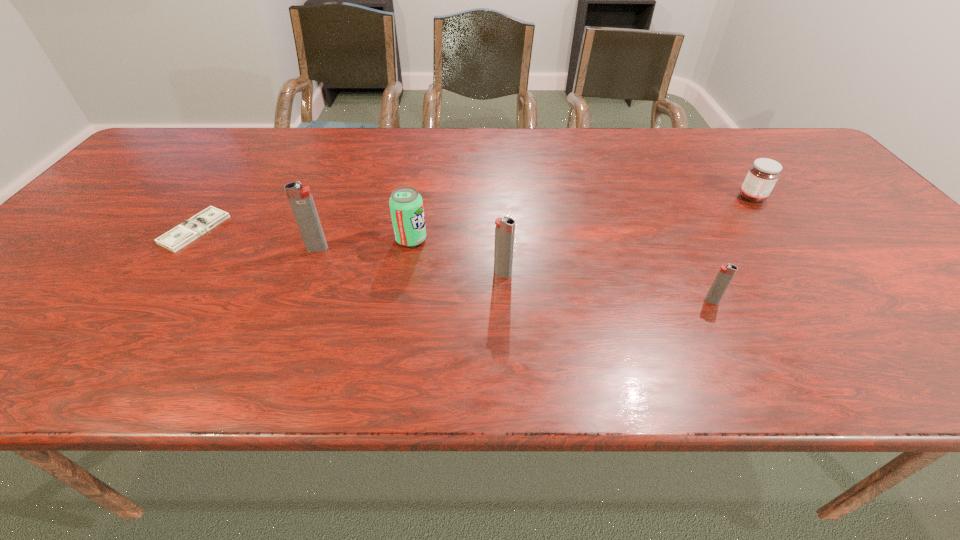
Locate an element on the screen. This screenshot has width=960, height=540. vacant space at the near edge of the desktop is located at coordinates (726, 317).

Find the location of a particular element. free space at the left edge of the desktop is located at coordinates (108, 217).

The height and width of the screenshot is (540, 960). In the image, there is a desktop. In order to click on vacant space at the right edge in this screenshot , I will do `click(811, 167)`.

What are the coordinates of `vacant area at the far left corner of the desktop` in the screenshot? It's located at (194, 159).

The image size is (960, 540). Find the location of `free space at the far right corner of the desktop`. free space at the far right corner of the desktop is located at coordinates (792, 136).

At what (x,y) coordinates should I click in order to perform the action: click on free space that is in between the nearest igniter and the shortest object. Please return your answer as a coordinate pair (x, y). This screenshot has width=960, height=540. Looking at the image, I should click on (453, 265).

At what (x,y) coordinates should I click in order to perform the action: click on vacant space that is in between the farthest object and the shortest object. Please return your answer as a coordinate pair (x, y). This screenshot has height=540, width=960. Looking at the image, I should click on (473, 213).

This screenshot has width=960, height=540. What are the coordinates of `vacant space that is in between the jam and the third tallest object` in the screenshot? It's located at (582, 218).

This screenshot has width=960, height=540. What are the coordinates of `vacant space in between the second tallest igniter and the rightmost igniter` in the screenshot? It's located at (607, 287).

At what (x,y) coordinates should I click in order to perform the action: click on free space between the farthest object and the third tallest object. Please return your answer as a coordinate pair (x, y). The image size is (960, 540). Looking at the image, I should click on (582, 218).